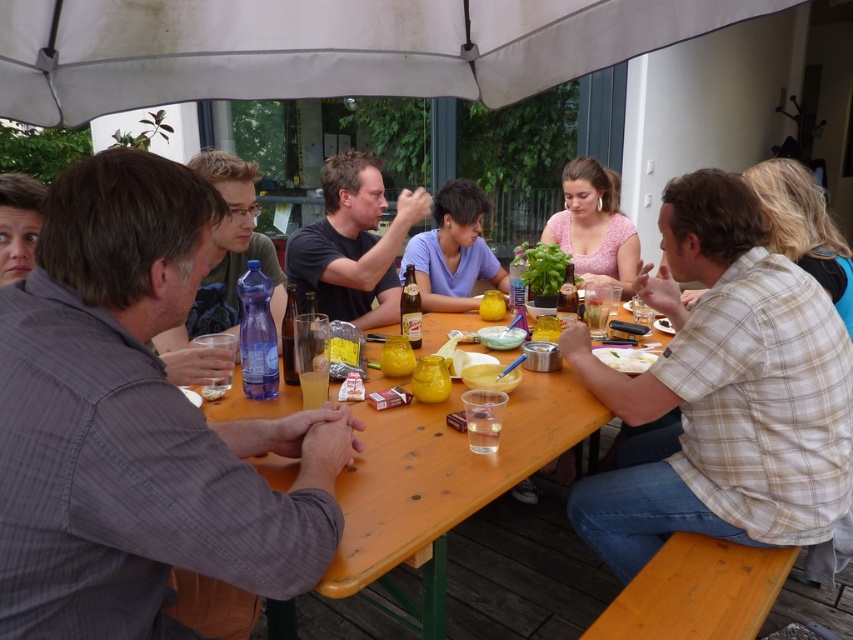
Question: Is matte plastic water bottle at left in front of translucent plastic cup at table center?

Choices:
 (A) yes
 (B) no

Answer: (A)

Question: Does clear plastic cup at table center have a lesser width compared to translucent plastic cup at table center?

Choices:
 (A) yes
 (B) no

Answer: (A)

Question: Which object is positioned closest to the translucent plastic cup at table center?

Choices:
 (A) matte black shirt at center
 (B) white matte plate at lower right
 (C) translucent glass beer at table center

Answer: (C)

Question: Which point is farther to the camera?

Choices:
 (A) (207, 353)
 (B) (317, 228)

Answer: (B)

Question: Which point is closer to the camera taking this photo?

Choices:
 (A) (93, 467)
 (B) (312, 285)
 (C) (325, 394)

Answer: (A)

Question: Does gray striped shirt at left have a lesser width compared to matte black shirt at center?

Choices:
 (A) no
 (B) yes

Answer: (B)